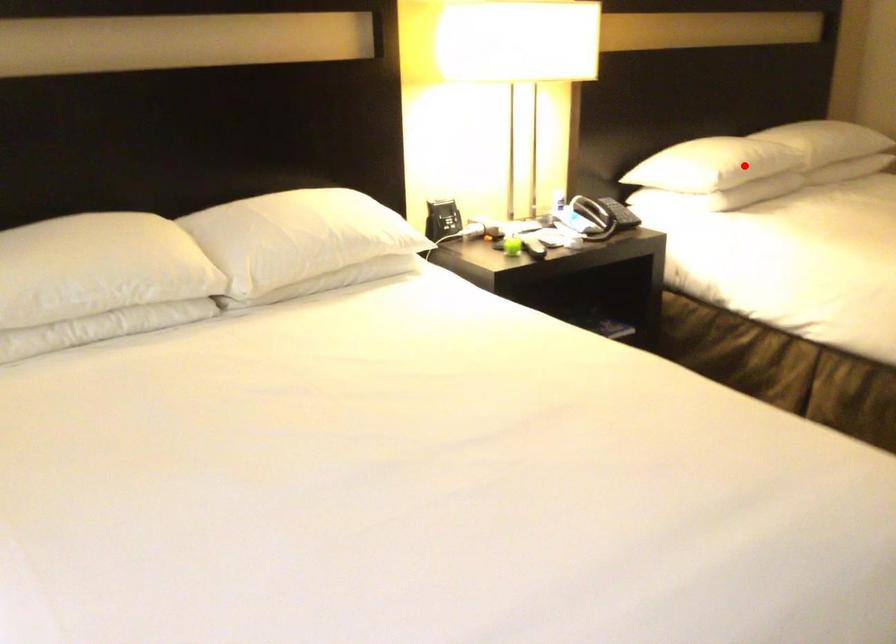
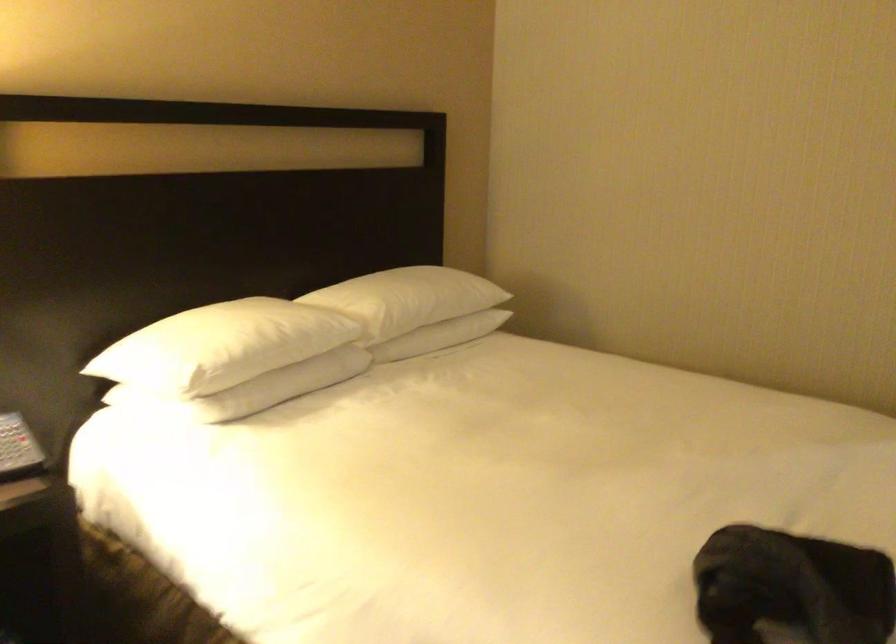
Question: A red point is marked in image1. In image2, is the corresponding 3D point closer to the camera or farther? Reply with the corresponding letter.

Choices:
 (A) The corresponding 3D point is closer.
 (B) The corresponding 3D point is farther.

Answer: (A)